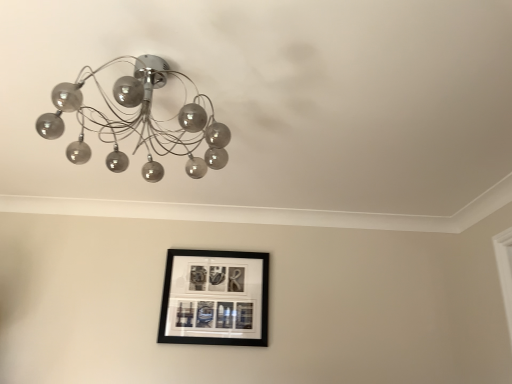
Question: Is satin silver chandelier at upper left closer to camera compared to black matte picture frame at lower center?

Choices:
 (A) yes
 (B) no

Answer: (A)

Question: Can you confirm if satin silver chandelier at upper left is positioned to the left of black matte picture frame at lower center?

Choices:
 (A) yes
 (B) no

Answer: (A)

Question: From the image's perspective, does satin silver chandelier at upper left appear lower than black matte picture frame at lower center?

Choices:
 (A) yes
 (B) no

Answer: (B)

Question: Does satin silver chandelier at upper left have a lesser height compared to black matte picture frame at lower center?

Choices:
 (A) no
 (B) yes

Answer: (B)

Question: From a real-world perspective, is satin silver chandelier at upper left physically above black matte picture frame at lower center?

Choices:
 (A) no
 (B) yes

Answer: (B)

Question: Is the depth of satin silver chandelier at upper left greater than that of black matte picture frame at lower center?

Choices:
 (A) no
 (B) yes

Answer: (A)

Question: Is black matte picture frame at lower center thinner than satin silver chandelier at upper left?

Choices:
 (A) no
 (B) yes

Answer: (B)

Question: Does black matte picture frame at lower center have a greater height compared to satin silver chandelier at upper left?

Choices:
 (A) yes
 (B) no

Answer: (A)

Question: Is black matte picture frame at lower center completely or partially outside of satin silver chandelier at upper left?

Choices:
 (A) yes
 (B) no

Answer: (A)

Question: Is black matte picture frame at lower center positioned before satin silver chandelier at upper left?

Choices:
 (A) yes
 (B) no

Answer: (B)

Question: Are black matte picture frame at lower center and satin silver chandelier at upper left far apart?

Choices:
 (A) no
 (B) yes

Answer: (A)

Question: Is black matte picture frame at lower center at the right side of satin silver chandelier at upper left?

Choices:
 (A) yes
 (B) no

Answer: (A)

Question: In terms of height, does black matte picture frame at lower center look taller or shorter compared to satin silver chandelier at upper left?

Choices:
 (A) tall
 (B) short

Answer: (A)